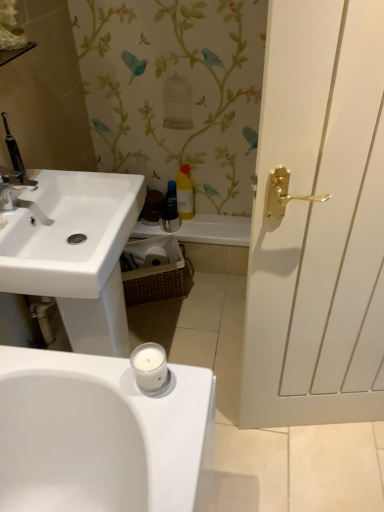
Question: Considering the positions of translucent plastic bottle at center, the 2th toiletry in the right-to-left sequence, and matte silver faucet at upper left in the image, is translucent plastic bottle at center, the 2th toiletry in the right-to-left sequence, wider or thinner than matte silver faucet at upper left?

Choices:
 (A) wide
 (B) thin

Answer: (B)

Question: In the image, is translucent plastic bottle at center, which ranks as the 1th toiletry in left-to-right order, positioned in front of or behind matte silver faucet at upper left?

Choices:
 (A) behind
 (B) front

Answer: (A)

Question: Which is farther from the matte silver faucet at upper left?

Choices:
 (A) white wood door at right
 (B) translucent plastic bottle at center, the 2th toiletry in the right-to-left sequence
 (C) white glossy bath at center
 (D) brown woven basket at center
 (E) yellow matte bottle at center, the first toiletry in the right-to-left sequence

Answer: (E)

Question: Estimate the real-world distances between objects in this image. Which object is farther from the white wood door at right?

Choices:
 (A) white glossy bath at center
 (B) yellow matte bottle at center, the first toiletry in the right-to-left sequence
 (C) matte silver faucet at upper left
 (D) translucent plastic bottle at center, the 2th toiletry in the right-to-left sequence
 (E) brown woven basket at center

Answer: (D)